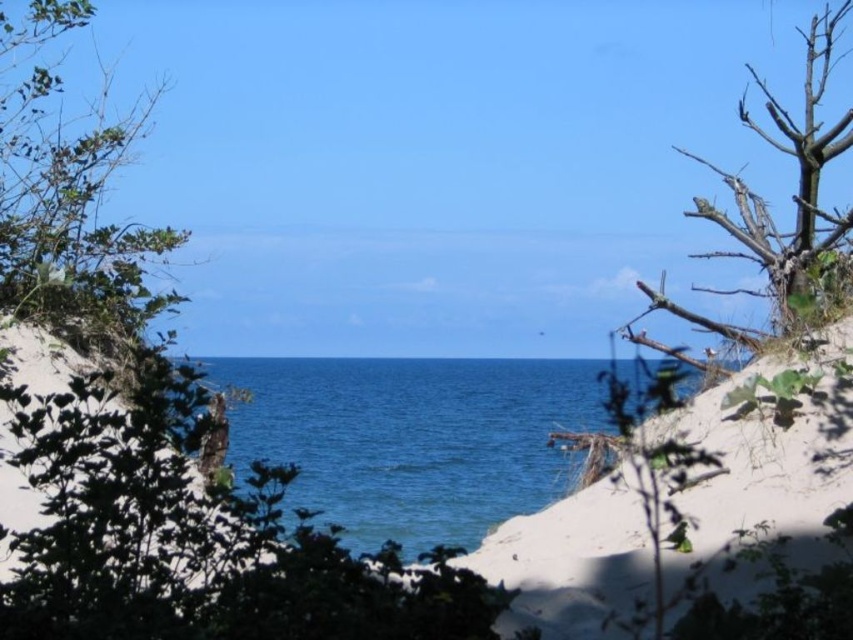
Between blue water at center and green leafy tree at left, which one has less height?

Standing shorter between the two is blue water at center.

Who is positioned more to the right, blue water at center or green leafy tree at left?

blue water at center is more to the right.

The width and height of the screenshot is (853, 640). What do you see at coordinates (412, 438) in the screenshot?
I see `blue water at center` at bounding box center [412, 438].

Find the location of a particular element. blue water at center is located at coordinates (412, 438).

Based on the photo, is blue water at center positioned at the back of brown rough tree at right?

Yes, it is behind brown rough tree at right.

Is point (381, 360) closer to viewer compared to point (786, 266)?

No, (381, 360) is behind (786, 266).

Where is `blue water at center`? This screenshot has height=640, width=853. blue water at center is located at coordinates (412, 438).

Can you confirm if green leafy tree at left is positioned below brown rough tree at right?

No.

Where is `green leafy tree at left`? green leafy tree at left is located at coordinates (67, 198).